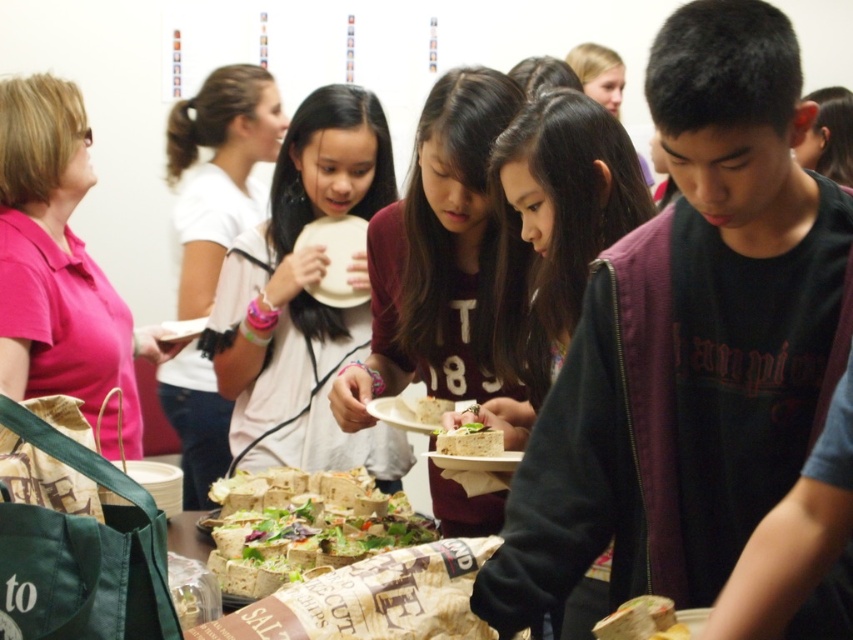
You are a photographer at the event and need to capture a photo of the maroon jersey at center and the crumbly brown cake at center. Which object is positioned higher in the frame?

The maroon jersey at center is positioned higher in the frame than the crumbly brown cake at center because the maroon jersey at center is above crumbly brown cake at center.

You are a child at the event and want to grab both the maroon jersey at center and the crumbly brown cake at center. Which one should you reach for first if you want to pick up the item that is closer to your left side?

The maroon jersey at center is to the left of crumbly brown cake at center, so you should reach for the maroon jersey at center first as it is closer to your left side.

You are standing in the middle of the room and want to locate the pink fabric shirt at left. Which direction should you look to find it?

You should look to the left to find the pink fabric shirt at left, as it is located at point 0.420 on the x and 0.072 on the y coordinate.